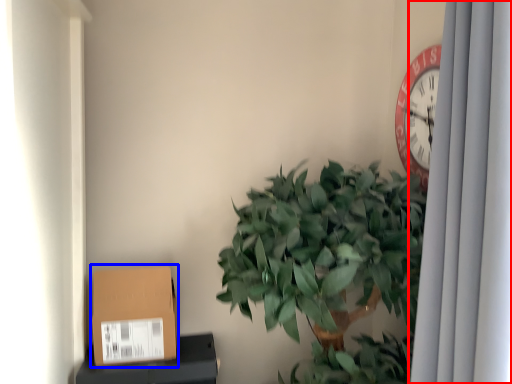
Question: Which object appears farthest to the camera in this image, curtain (highlighted by a red box) or cardboard box (highlighted by a blue box)?

Choices:
 (A) curtain
 (B) cardboard box

Answer: (B)